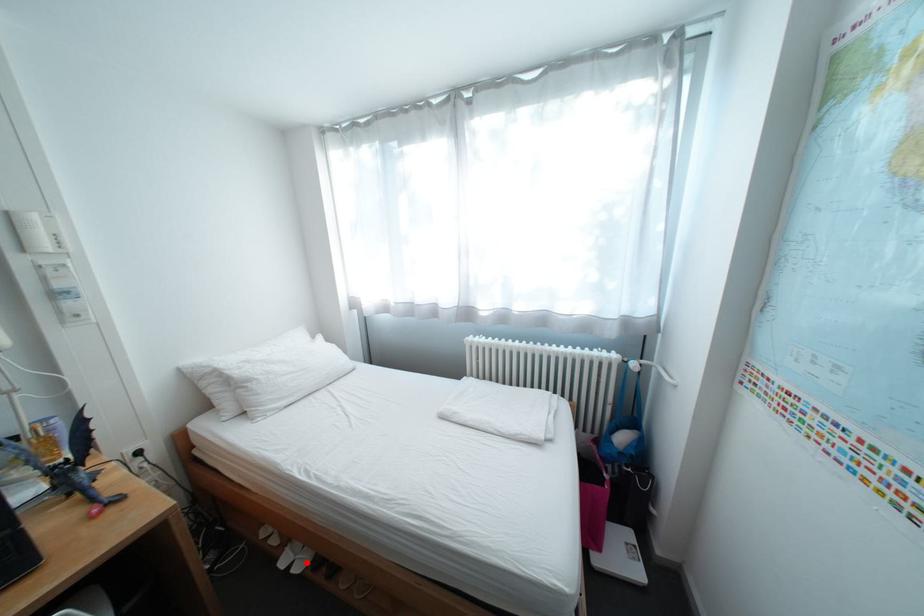
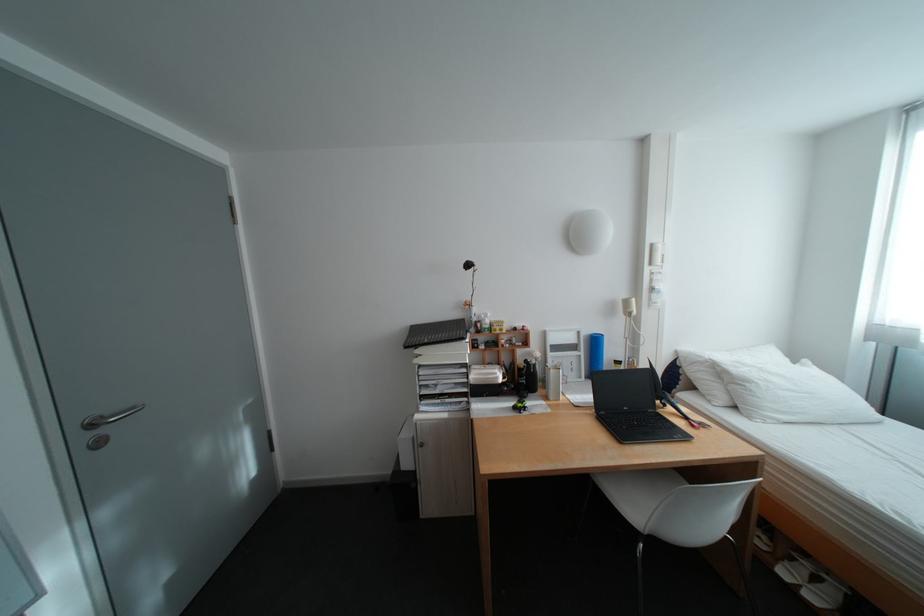
Find the pixel in the second image that matches the highlighted location in the first image.

(813, 586)